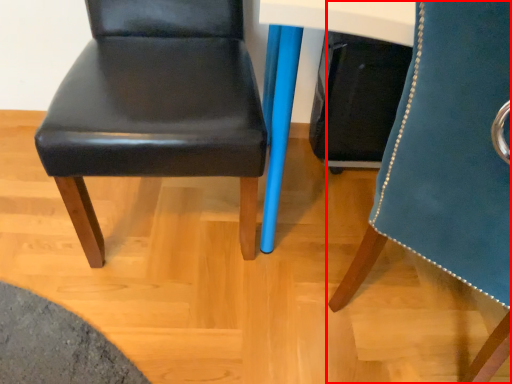
Question: From the image's perspective, where is chair (annotated by the red box) located relative to chair?

Choices:
 (A) above
 (B) below

Answer: (B)